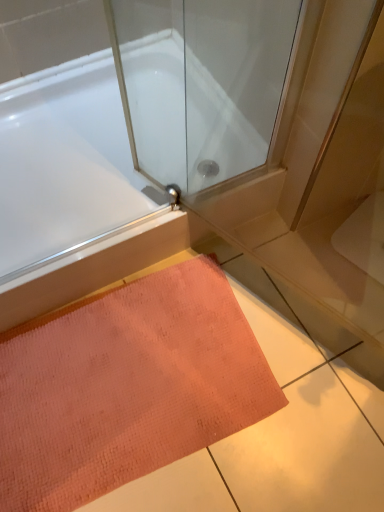
Question: Is orange textured mat at lower center at the right side of white glossy bathtub at upper left?

Choices:
 (A) no
 (B) yes

Answer: (B)

Question: Does orange textured mat at lower center have a greater width compared to white glossy bathtub at upper left?

Choices:
 (A) yes
 (B) no

Answer: (B)

Question: Does orange textured mat at lower center have a greater height compared to white glossy bathtub at upper left?

Choices:
 (A) no
 (B) yes

Answer: (A)

Question: Is orange textured mat at lower center far from white glossy bathtub at upper left?

Choices:
 (A) yes
 (B) no

Answer: (B)

Question: Considering the relative sizes of orange textured mat at lower center and white glossy bathtub at upper left in the image provided, is orange textured mat at lower center smaller than white glossy bathtub at upper left?

Choices:
 (A) no
 (B) yes

Answer: (B)

Question: Is orange textured mat at lower center outside white glossy bathtub at upper left?

Choices:
 (A) yes
 (B) no

Answer: (A)

Question: Can we say white glossy bathtub at upper left lies outside orange textured mat at lower center?

Choices:
 (A) no
 (B) yes

Answer: (B)

Question: Is white glossy bathtub at upper left next to orange textured mat at lower center?

Choices:
 (A) yes
 (B) no

Answer: (B)

Question: Is white glossy bathtub at upper left smaller than orange textured mat at lower center?

Choices:
 (A) no
 (B) yes

Answer: (A)

Question: Is white glossy bathtub at upper left taller than orange textured mat at lower center?

Choices:
 (A) no
 (B) yes

Answer: (B)

Question: From the image's perspective, is white glossy bathtub at upper left below orange textured mat at lower center?

Choices:
 (A) yes
 (B) no

Answer: (B)

Question: Is orange textured mat at lower center at the back of white glossy bathtub at upper left?

Choices:
 (A) no
 (B) yes

Answer: (A)

Question: From a real-world perspective, is orange textured mat at lower center positioned above or below white glossy bathtub at upper left?

Choices:
 (A) above
 (B) below

Answer: (B)